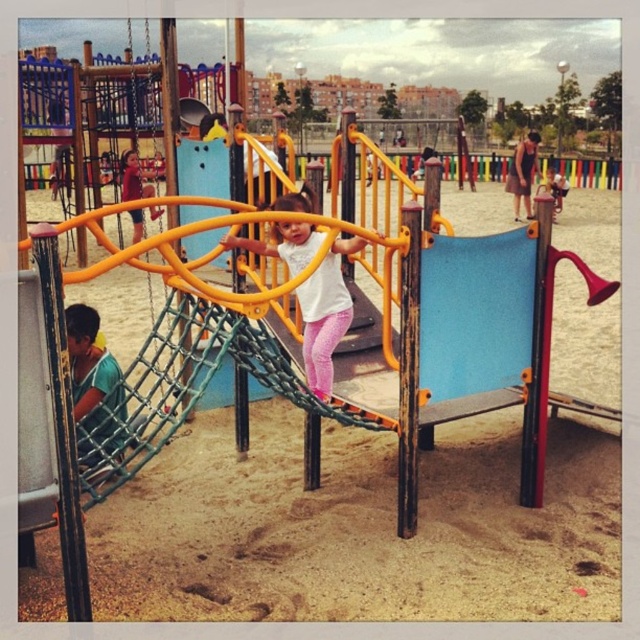
Question: Which of these objects is positioned farthest from the matte red shirt at upper left?

Choices:
 (A) white matte shirt at center
 (B) blue matte slide at center

Answer: (B)

Question: Does white matte shirt at center have a greater width compared to matte red shirt at upper left?

Choices:
 (A) no
 (B) yes

Answer: (B)

Question: Is blue matte slide at center closer to the viewer compared to white matte shirt at center?

Choices:
 (A) yes
 (B) no

Answer: (B)

Question: Which of these objects is positioned farthest from the matte red shirt at upper left?

Choices:
 (A) blue matte slide at center
 (B) white matte shirt at center

Answer: (A)

Question: Which point is closer to the camera taking this photo?

Choices:
 (A) (145, 170)
 (B) (330, 330)

Answer: (B)

Question: Does blue matte slide at center appear on the right side of white matte shirt at center?

Choices:
 (A) yes
 (B) no

Answer: (A)